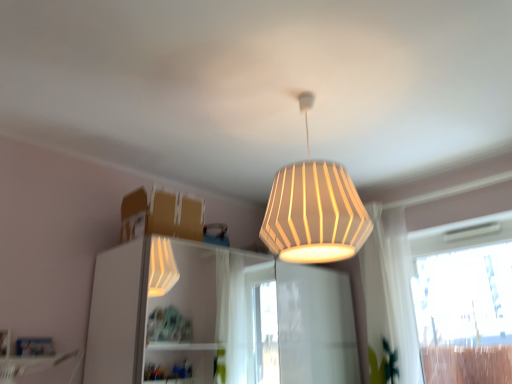
This screenshot has height=384, width=512. What do you see at coordinates (390, 292) in the screenshot? I see `white sheer curtain at right` at bounding box center [390, 292].

What do you see at coordinates (314, 209) in the screenshot? I see `white ribbed lampshade at upper center` at bounding box center [314, 209].

Image resolution: width=512 pixels, height=384 pixels. Identify the location of white glossy dresser at center. (214, 317).

Describe the element at coordinates (465, 315) in the screenshot. I see `transparent glass window at right` at that location.

Where is `white sheer curtain at right`? Image resolution: width=512 pixels, height=384 pixels. white sheer curtain at right is located at coordinates (390, 292).

Considering the positions of points (150, 357) and (388, 296), is point (150, 357) farther from camera compared to point (388, 296)?

Yes, point (150, 357) is farther from viewer.

Is white glossy dresser at center outside of white sheer curtain at right?

That's correct, white glossy dresser at center is outside of white sheer curtain at right.

Based on the photo, is white glossy dresser at center not near white sheer curtain at right?

white glossy dresser at center is far away from white sheer curtain at right.

Based on the photo, is white glossy dresser at center thinner than white sheer curtain at right?

Incorrect, the width of white glossy dresser at center is not less than that of white sheer curtain at right.

Would you say white ribbed lampshade at upper center contains white glossy dresser at center?

No.

Is point (292, 259) more distant than point (247, 377)?

No, (292, 259) is closer to viewer.

Measure the distance from white ribbed lampshade at upper center to white glossy dresser at center.

They are 2.47 meters apart.

Measure the distance from transparent glass window at right to white ribbed lampshade at upper center.

A distance of 5.96 feet exists between transparent glass window at right and white ribbed lampshade at upper center.

How many degrees apart are the facing directions of transparent glass window at right and white ribbed lampshade at upper center?

The facing directions of transparent glass window at right and white ribbed lampshade at upper center are 2.09 degrees apart.

Considering the sizes of objects transparent glass window at right and white ribbed lampshade at upper center in the image provided, who is shorter, transparent glass window at right or white ribbed lampshade at upper center?

Standing shorter between the two is white ribbed lampshade at upper center.

From the picture: Do you think transparent glass window at right is within white ribbed lampshade at upper center, or outside of it?

transparent glass window at right is outside white ribbed lampshade at upper center.

Which object is more forward, white sheer curtain at right or transparent glass window at right?

transparent glass window at right is in front.

Can you confirm if white sheer curtain at right is bigger than transparent glass window at right?

Actually, white sheer curtain at right might be smaller than transparent glass window at right.

Can you see white sheer curtain at right touching transparent glass window at right?

No, white sheer curtain at right is not touching transparent glass window at right.

Locate an element on the screen. The width and height of the screenshot is (512, 384). curtain behind the transparent glass window at right is located at coordinates (390, 292).

Which is more to the right, white sheer curtain at right or white ribbed lampshade at upper center?

From the viewer's perspective, white sheer curtain at right appears more on the right side.

Which of these two, white sheer curtain at right or white ribbed lampshade at upper center, is wider?

white ribbed lampshade at upper center is wider.

From the image's perspective, between white sheer curtain at right and white ribbed lampshade at upper center, who is located below?

white sheer curtain at right is shown below in the image.

Between point (383, 264) and point (304, 240), which one is positioned in front?

The point (304, 240) is more forward.

Looking at this image, which point is more distant from viewer, (445, 277) or (410, 302)?

The point (445, 277) is behind.

Between transparent glass window at right and white sheer curtain at right, which one has larger width?

white sheer curtain at right.

From the picture: From the image's perspective, is transparent glass window at right located above or below white sheer curtain at right?

Clearly, from the image's perspective, transparent glass window at right is below white sheer curtain at right.

Does transparent glass window at right have a lesser height compared to white sheer curtain at right?

Indeed, transparent glass window at right has a lesser height compared to white sheer curtain at right.

Is white sheer curtain at right directly adjacent to white glossy dresser at center?

No.

Considering the sizes of white sheer curtain at right and white glossy dresser at center in the image, is white sheer curtain at right bigger or smaller than white glossy dresser at center?

In the image, white sheer curtain at right appears to be smaller than white glossy dresser at center.

In the image, is white sheer curtain at right positioned in front of or behind white glossy dresser at center?

white sheer curtain at right is positioned farther from the viewer than white glossy dresser at center.

Locate an element on the screen. dresser beneath the white sheer curtain at right (from a real-world perspective) is located at coordinates (214, 317).

Locate an element on the screen. lamp to the right of white glossy dresser at center is located at coordinates (314, 209).

Based on their spatial positions, is white ribbed lampshade at upper center or white sheer curtain at right further from transparent glass window at right?

white ribbed lampshade at upper center lies further to transparent glass window at right than the other object.

Based on their spatial positions, is transparent glass window at right or white sheer curtain at right closer to white glossy dresser at center?

white sheer curtain at right is positioned closer to the anchor white glossy dresser at center.

When comparing their distances from white ribbed lampshade at upper center, does transparent glass window at right or white sheer curtain at right seem further?

Based on the image, transparent glass window at right appears to be further to white ribbed lampshade at upper center.

Which object lies nearer to the anchor point white ribbed lampshade at upper center, transparent glass window at right or white glossy dresser at center?

Among the two, transparent glass window at right is located nearer to white ribbed lampshade at upper center.

Looking at the image, which one is located closer to transparent glass window at right, white glossy dresser at center or white sheer curtain at right?

The object closer to transparent glass window at right is white sheer curtain at right.

When comparing their distances from transparent glass window at right, does white sheer curtain at right or white glossy dresser at center seem further?

Among the two, white glossy dresser at center is located further to transparent glass window at right.

When comparing their distances from white glossy dresser at center, does transparent glass window at right or white ribbed lampshade at upper center seem closer?

transparent glass window at right is positioned closer to the anchor white glossy dresser at center.

Considering their positions, is white glossy dresser at center positioned closer to white sheer curtain at right than transparent glass window at right?

transparent glass window at right.

You are a GUI agent. You are given a task and a screenshot of the screen. Output one action in this format:
    pyautogui.click(x=<x>, y=<y>)
    Task: Click on the curtain situated between white ribbed lampshade at upper center and transparent glass window at right from left to right
    This screenshot has width=512, height=384.
    Given the screenshot: What is the action you would take?
    pyautogui.click(x=390, y=292)

Identify the location of lamp between white glossy dresser at center and white sheer curtain at right in the horizontal direction. This screenshot has height=384, width=512. coord(314,209).

Identify the location of curtain situated between white glossy dresser at center and transparent glass window at right from left to right. This screenshot has height=384, width=512. (390, 292).

The width and height of the screenshot is (512, 384). What are the coordinates of `lamp between white glossy dresser at center and transparent glass window at right from left to right` in the screenshot? It's located at click(314, 209).